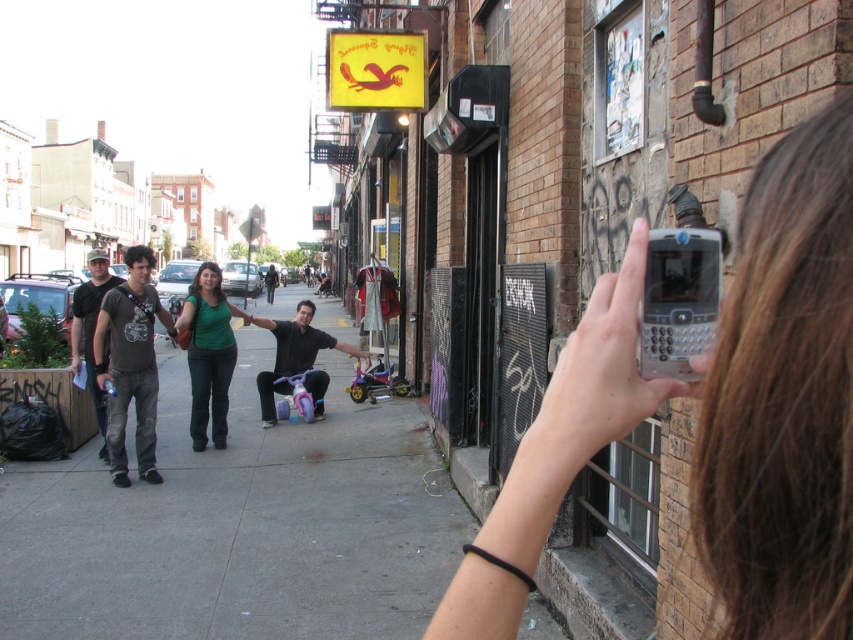
Question: Estimate the real-world distances between objects in this image. Which object is closer to the gray concrete sidewalk at center?

Choices:
 (A) matte gray t-shirt at center
 (B) clear plastic phone at center

Answer: (A)

Question: Is smooth silver phone at center right to the left of green matte shirt at center from the viewer's perspective?

Choices:
 (A) no
 (B) yes

Answer: (A)

Question: Based on their relative distances, which object is nearer to the silver metallic smartphone at upper right?

Choices:
 (A) green matte shirt at center
 (B) clear plastic phone at center

Answer: (B)

Question: Which point is farther to the camera?

Choices:
 (A) (297, 307)
 (B) (198, 433)
 (C) (663, 240)

Answer: (A)

Question: Does gray concrete sidewalk at center appear under green matte shirt at center?

Choices:
 (A) no
 (B) yes

Answer: (B)

Question: Considering the relative positions of gray concrete sidewalk at center and green matte shirt at center in the image provided, where is gray concrete sidewalk at center located with respect to green matte shirt at center?

Choices:
 (A) left
 (B) right

Answer: (B)